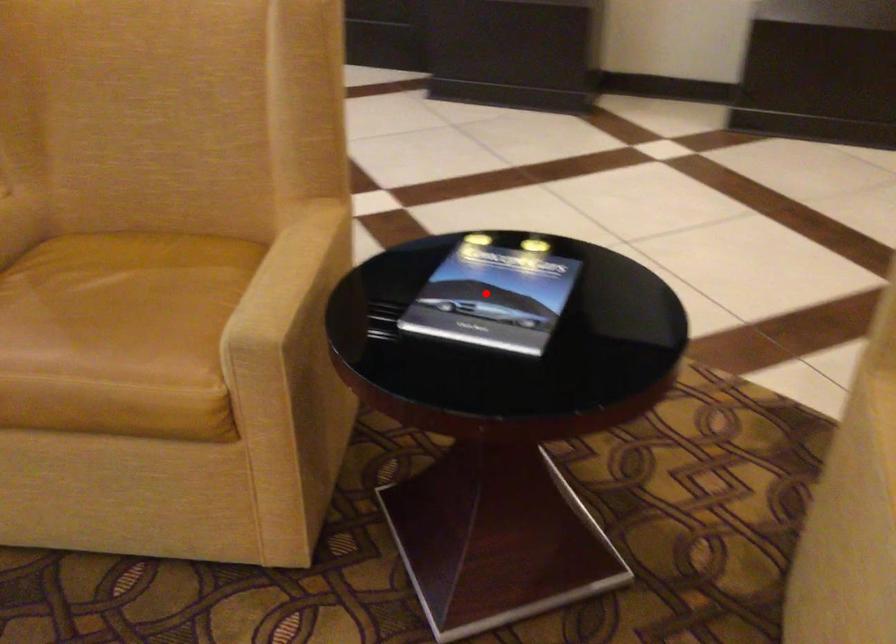
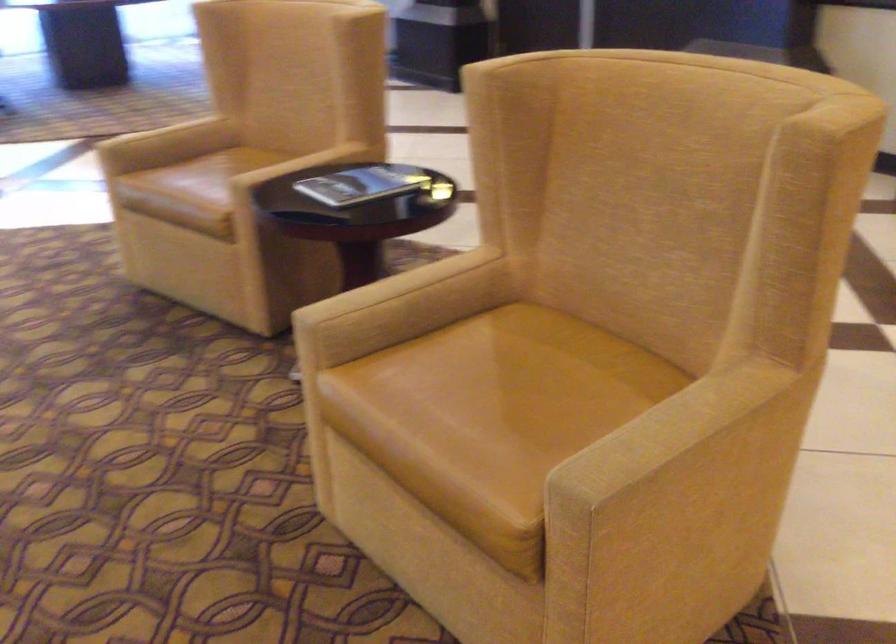
Locate, in the second image, the point that corresponds to the highlighted location in the first image.

(363, 184)